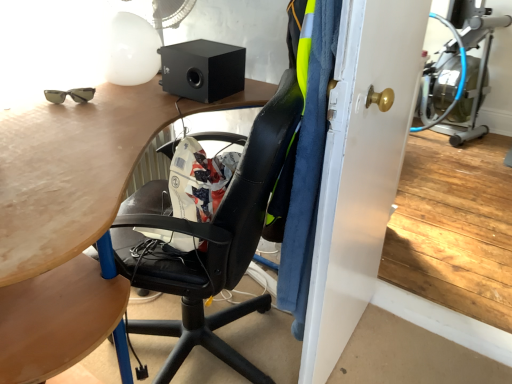
Question: Is matte wood desk at center completely or partially inside matte gold door handle at center?

Choices:
 (A) yes
 (B) no

Answer: (B)

Question: Is matte gold door handle at center shorter than matte wood desk at center?

Choices:
 (A) yes
 (B) no

Answer: (B)

Question: Is matte gold door handle at center oriented towards matte wood desk at center?

Choices:
 (A) yes
 (B) no

Answer: (B)

Question: From the image's perspective, does matte gold door handle at center appear higher than matte wood desk at center?

Choices:
 (A) no
 (B) yes

Answer: (B)

Question: Considering the relative positions of matte gold door handle at center and matte wood desk at center in the image provided, is matte gold door handle at center to the right of matte wood desk at center from the viewer's perspective?

Choices:
 (A) no
 (B) yes

Answer: (B)

Question: Is matte gold door handle at center taller than matte wood desk at center?

Choices:
 (A) no
 (B) yes

Answer: (B)

Question: Does white plastic mechanical fan at upper center have a larger size compared to matte gold door handle at center?

Choices:
 (A) no
 (B) yes

Answer: (A)

Question: From a real-world perspective, is white plastic mechanical fan at upper center on top of matte gold door handle at center?

Choices:
 (A) yes
 (B) no

Answer: (A)

Question: Is white plastic mechanical fan at upper center oriented away from matte gold door handle at center?

Choices:
 (A) no
 (B) yes

Answer: (A)

Question: Are white plastic mechanical fan at upper center and matte gold door handle at center beside each other?

Choices:
 (A) yes
 (B) no

Answer: (B)

Question: Is white plastic mechanical fan at upper center at the left side of matte gold door handle at center?

Choices:
 (A) yes
 (B) no

Answer: (A)

Question: Is white plastic mechanical fan at upper center taller than matte gold door handle at center?

Choices:
 (A) no
 (B) yes

Answer: (A)

Question: Is black matte speaker at upper center at the right side of matte wood desk at center?

Choices:
 (A) no
 (B) yes

Answer: (B)